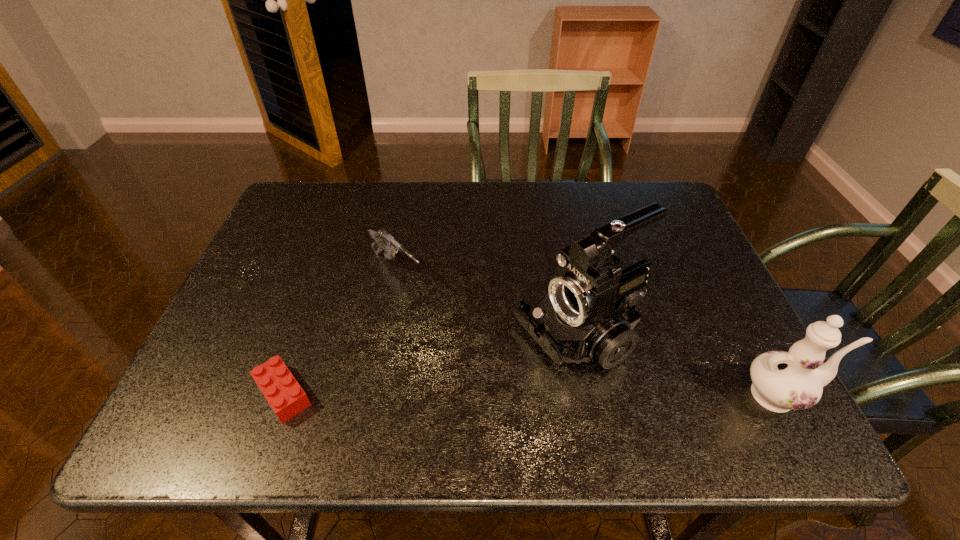
This screenshot has width=960, height=540. I want to click on vacant space located at the barrel of the third tallest object, so click(516, 378).

Where is `free location located at the barrel of the third tallest object`? free location located at the barrel of the third tallest object is located at coordinates (445, 315).

Identify the location of vacant region located on the lens mount of the camcorder. (497, 372).

I want to click on free spot located 0.110m on the lens mount of the camcorder, so click(x=481, y=381).

The width and height of the screenshot is (960, 540). In order to click on vacant space located 0.150m on the lens mount of the camcorder in this screenshot , I will do click(464, 390).

What are the coordinates of `Lego at the near edge` in the screenshot? It's located at pos(284,394).

Locate an element on the screen. chinaware positioned at the near edge is located at coordinates (782, 381).

Locate an element on the screen. camcorder at the near edge is located at coordinates 588,313.

This screenshot has height=540, width=960. I want to click on object that is at the left edge, so pyautogui.click(x=284, y=394).

Where is `object that is at the right edge`? This screenshot has width=960, height=540. object that is at the right edge is located at coordinates (782, 381).